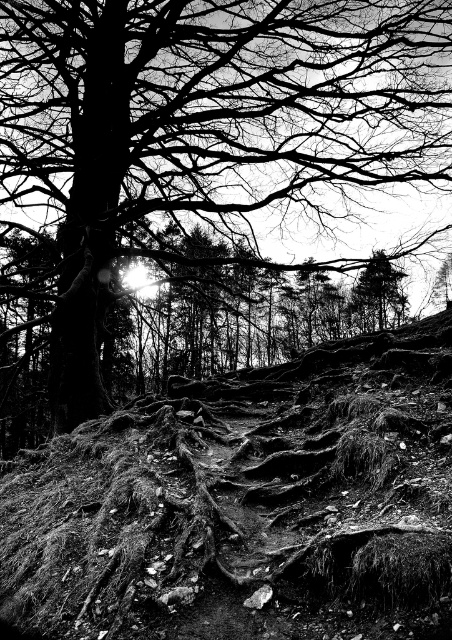
Who is higher up, dull earthy soil at center or dark bark tree at upper left?

dark bark tree at upper left is higher up.

Which of these two, dull earthy soil at center or dark bark tree at upper left, stands taller?

With more height is dull earthy soil at center.

Locate an element on the screen. The height and width of the screenshot is (640, 452). dull earthy soil at center is located at coordinates (246, 502).

Describe the element at coordinates (205, 125) in the screenshot. Image resolution: width=452 pixels, height=640 pixels. I see `dark bark tree at upper left` at that location.

Who is higher up, dark bark tree at upper left or smooth bark tree at upper center?

dark bark tree at upper left

Locate an element on the screen. This screenshot has height=640, width=452. dark bark tree at upper left is located at coordinates (205, 125).

Can you confirm if dull earthy soil at center is taller than smooth bark tree at upper center?

Indeed, dull earthy soil at center has a greater height compared to smooth bark tree at upper center.

Which is in front, point (14, 465) or point (353, 301)?

Point (14, 465) is more forward.

This screenshot has width=452, height=640. Identify the location of dull earthy soil at center. (246, 502).